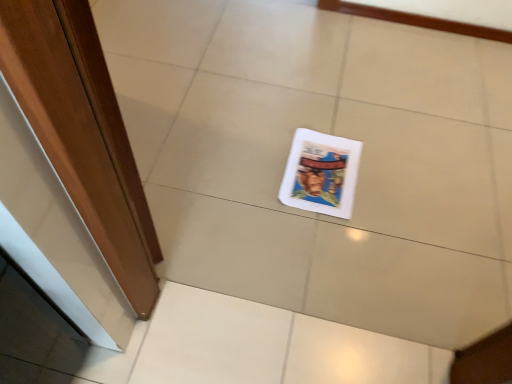
At what (x,y) coordinates should I click in order to perform the action: click on vacant space that's between wooden door at left and white glossy magazine at center. Please return your answer as a coordinate pair (x, y). The height and width of the screenshot is (384, 512). Looking at the image, I should click on (233, 188).